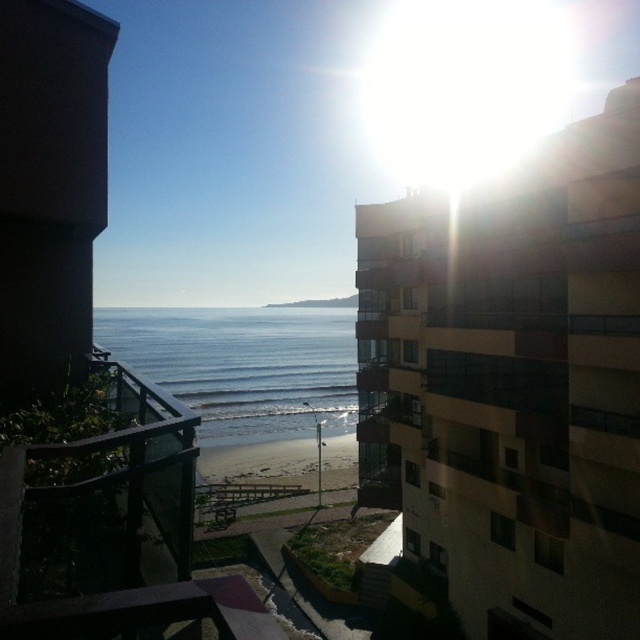
Consider the image. Between blue glassy water at center and sandy beach at center, which one is positioned lower?

sandy beach at center is lower down.

Is blue glassy water at center to the right of sandy beach at center from the viewer's perspective?

In fact, blue glassy water at center is to the left of sandy beach at center.

The image size is (640, 640). Find the location of `blue glassy water at center`. blue glassy water at center is located at coordinates (243, 365).

Between glass railing at center and blue glassy water at center, which one appears on the right side from the viewer's perspective?

glass railing at center

Does glass railing at center have a lesser height compared to blue glassy water at center?

Indeed, glass railing at center has a lesser height compared to blue glassy water at center.

Who is more forward, (x=209, y=616) or (x=272, y=349)?

Positioned in front is point (x=209, y=616).

Identify the location of glass railing at center. The width and height of the screenshot is (640, 640). (125, 529).

Who is more distant from viewer, (92, 444) or (342, 451)?

Point (342, 451)

Does glass railing at center have a smaller size compared to sandy beach at center?

Yes.

Is point (161, 394) farther from camera compared to point (246, 484)?

No, (161, 394) is closer to viewer.

Identify the location of glass railing at center. Image resolution: width=640 pixels, height=640 pixels. (125, 529).